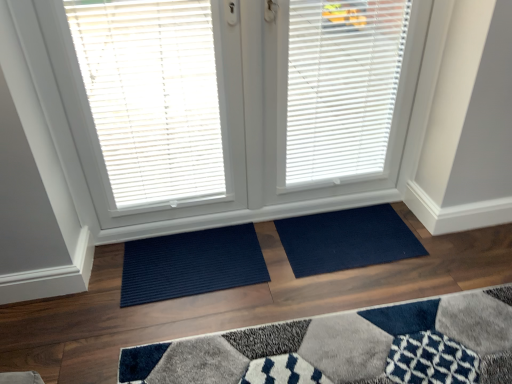
This screenshot has height=384, width=512. What do you see at coordinates (338, 89) in the screenshot? I see `white matte window blind at center, the 1th window blind from the right` at bounding box center [338, 89].

This screenshot has height=384, width=512. I want to click on white matte window blind at center, which ranks as the second window blind in left-to-right order, so click(x=338, y=89).

The image size is (512, 384). What are the coordinates of `navy blue textured mat at lower center, marked as the 2th doormat in a right-to-left arrangement` in the screenshot? It's located at (191, 264).

Describe the element at coordinates (249, 102) in the screenshot. I see `white matte blinds at center` at that location.

At what (x,y) coordinates should I click in order to perform the action: click on white matte blinds at center. Please return your answer as a coordinate pair (x, y). This screenshot has height=384, width=512. Looking at the image, I should click on (249, 102).

What do you see at coordinates (152, 96) in the screenshot? I see `white plastic blinds at upper left, which appears as the first window blind when viewed from the left` at bounding box center [152, 96].

Describe the element at coordinates (346, 240) in the screenshot. I see `navy blue mat at center, the 1th doormat when ordered from right to left` at that location.

Locate an element on the screen. The width and height of the screenshot is (512, 384). white matte window blind at center, which ranks as the second window blind in left-to-right order is located at coordinates pos(338,89).

Considering the sizes of navy blue textured mat at lower center, marked as the 2th doormat in a right-to-left arrangement, and white matte window blind at center, the 1th window blind from the right, in the image, is navy blue textured mat at lower center, marked as the 2th doormat in a right-to-left arrangement, taller or shorter than white matte window blind at center, the 1th window blind from the right,?

navy blue textured mat at lower center, marked as the 2th doormat in a right-to-left arrangement, is shorter than white matte window blind at center, the 1th window blind from the right.

Is navy blue textured mat at lower center, marked as the 2th doormat in a right-to-left arrangement, inside the boundaries of white matte window blind at center, the 1th window blind from the right, or outside?

navy blue textured mat at lower center, marked as the 2th doormat in a right-to-left arrangement, is spatially situated outside white matte window blind at center, the 1th window blind from the right.

Is the surface of navy blue textured mat at lower center, which is counted as the first doormat, starting from the left, in direct contact with white matte window blind at center, which ranks as the second window blind in left-to-right order?

No, navy blue textured mat at lower center, which is counted as the first doormat, starting from the left, is not beside white matte window blind at center, which ranks as the second window blind in left-to-right order.

Which of these two, navy blue textured mat at lower center, marked as the 2th doormat in a right-to-left arrangement, or white matte window blind at center, the 1th window blind from the right, is wider?

navy blue textured mat at lower center, marked as the 2th doormat in a right-to-left arrangement.

Considering the relative positions of white plastic blinds at upper left, which appears as the first window blind when viewed from the left, and white matte window blind at center, the 1th window blind from the right, in the image provided, is white plastic blinds at upper left, which appears as the first window blind when viewed from the left, in front of white matte window blind at center, the 1th window blind from the right,?

Yes.

Considering the positions of points (198, 139) and (312, 114), is point (198, 139) closer to camera compared to point (312, 114)?

Yes.

From the image's perspective, is white plastic blinds at upper left, which ranks as the second window blind in right-to-left order, located beneath white matte window blind at center, the 1th window blind from the right?

Yes.

Which object is wider, navy blue textured mat at lower center, marked as the 2th doormat in a right-to-left arrangement, or white matte blinds at center?

Wider between the two is navy blue textured mat at lower center, marked as the 2th doormat in a right-to-left arrangement.

Is the surface of navy blue textured mat at lower center, marked as the 2th doormat in a right-to-left arrangement, in direct contact with white matte blinds at center?

No, navy blue textured mat at lower center, marked as the 2th doormat in a right-to-left arrangement, is not beside white matte blinds at center.

Consider the image. Is white matte blinds at center inside navy blue textured mat at lower center, marked as the 2th doormat in a right-to-left arrangement?

Definitely not — white matte blinds at center is not inside navy blue textured mat at lower center, marked as the 2th doormat in a right-to-left arrangement.

Locate an element on the screen. Image resolution: width=512 pixels, height=384 pixels. doormat that is the 2nd one below the white matte blinds at center (from a real-world perspective) is located at coordinates (191, 264).

Is navy blue textured mat at lower center, marked as the 2th doormat in a right-to-left arrangement, situated inside white plastic blinds at upper left, which appears as the first window blind when viewed from the left, or outside?

navy blue textured mat at lower center, marked as the 2th doormat in a right-to-left arrangement, exists outside the volume of white plastic blinds at upper left, which appears as the first window blind when viewed from the left.

There is a white plastic blinds at upper left, which appears as the first window blind when viewed from the left. In order to click on the 2nd doormat below it (from the image's perspective) in this screenshot , I will do `click(191, 264)`.

Between navy blue textured mat at lower center, which is counted as the first doormat, starting from the left, and white plastic blinds at upper left, which appears as the first window blind when viewed from the left, which one appears on the left side from the viewer's perspective?

From the viewer's perspective, white plastic blinds at upper left, which appears as the first window blind when viewed from the left, appears more on the left side.

Based on the photo, which object is thinner, navy blue textured mat at lower center, which is counted as the first doormat, starting from the left, or white plastic blinds at upper left, which ranks as the second window blind in right-to-left order?

white plastic blinds at upper left, which ranks as the second window blind in right-to-left order.

Looking at this image, in the image, is white matte blinds at center positioned in front of or behind white plastic blinds at upper left, which appears as the first window blind when viewed from the left?

Visually, white matte blinds at center is located behind white plastic blinds at upper left, which appears as the first window blind when viewed from the left.

Where is `bay window above the white plastic blinds at upper left, which ranks as the second window blind in right-to-left order (from the image's perspective)`? The image size is (512, 384). bay window above the white plastic blinds at upper left, which ranks as the second window blind in right-to-left order (from the image's perspective) is located at coordinates (249, 102).

From the image's perspective, which is above, white matte blinds at center or white plastic blinds at upper left, which ranks as the second window blind in right-to-left order?

white matte blinds at center is shown above in the image.

Which object is wider, white plastic blinds at upper left, which appears as the first window blind when viewed from the left, or white matte blinds at center?

white matte blinds at center is wider.

Which is behind, white plastic blinds at upper left, which appears as the first window blind when viewed from the left, or white matte blinds at center?

white matte blinds at center is more distant.

From a real-world perspective, is white plastic blinds at upper left, which ranks as the second window blind in right-to-left order, over white matte blinds at center?

Yes, from a real-world perspective, white plastic blinds at upper left, which ranks as the second window blind in right-to-left order, is over white matte blinds at center

Is white plastic blinds at upper left, which ranks as the second window blind in right-to-left order, oriented away from white matte blinds at center?

Yes, white plastic blinds at upper left, which ranks as the second window blind in right-to-left order, is facing away from white matte blinds at center.

Does point (167, 46) come closer to viewer compared to point (122, 296)?

Yes, it is.

Measure the distance from white plastic blinds at upper left, which appears as the first window blind when viewed from the left, to navy blue textured mat at lower center, marked as the 2th doormat in a right-to-left arrangement.

18.95 inches.

Considering the relative sizes of white plastic blinds at upper left, which appears as the first window blind when viewed from the left, and navy blue textured mat at lower center, which is counted as the first doormat, starting from the left, in the image provided, is white plastic blinds at upper left, which appears as the first window blind when viewed from the left, taller than navy blue textured mat at lower center, which is counted as the first doormat, starting from the left,?

Yes.

Which is correct: white plastic blinds at upper left, which ranks as the second window blind in right-to-left order, is inside navy blue textured mat at lower center, which is counted as the first doormat, starting from the left, or outside of it?

The correct answer is: outside.

The width and height of the screenshot is (512, 384). In order to click on the 1st window blind in front of the navy blue textured mat at lower center, marked as the 2th doormat in a right-to-left arrangement in this screenshot , I will do `click(338, 89)`.

Where is `window blind above the white plastic blinds at upper left, which appears as the first window blind when viewed from the left (from the image's perspective)`? window blind above the white plastic blinds at upper left, which appears as the first window blind when viewed from the left (from the image's perspective) is located at coordinates (338, 89).

Which object lies further to the anchor point navy blue textured mat at lower center, which is counted as the first doormat, starting from the left, navy blue mat at center, the 1th doormat when ordered from right to left, or white matte blinds at center?

The object further to navy blue textured mat at lower center, which is counted as the first doormat, starting from the left, is white matte blinds at center.

From the picture: Estimate the real-world distances between objects in this image. Which object is further from navy blue mat at center, the 1th doormat when ordered from right to left, white matte blinds at center or navy blue textured mat at lower center, marked as the 2th doormat in a right-to-left arrangement?

white matte blinds at center lies further to navy blue mat at center, the 1th doormat when ordered from right to left, than the other object.

From the image, which object appears to be nearer to white plastic blinds at upper left, which appears as the first window blind when viewed from the left, white matte window blind at center, which ranks as the second window blind in left-to-right order, or navy blue mat at center, the 1th doormat when ordered from right to left?

Based on the image, white matte window blind at center, which ranks as the second window blind in left-to-right order, appears to be nearer to white plastic blinds at upper left, which appears as the first window blind when viewed from the left.

Looking at the image, which one is located closer to navy blue textured mat at lower center, marked as the 2th doormat in a right-to-left arrangement, navy blue mat at center, which appears as the second doormat when viewed from the left, or white plastic blinds at upper left, which appears as the first window blind when viewed from the left?

navy blue mat at center, which appears as the second doormat when viewed from the left, is closer to navy blue textured mat at lower center, marked as the 2th doormat in a right-to-left arrangement.

Estimate the real-world distances between objects in this image. Which object is further from navy blue mat at center, the 1th doormat when ordered from right to left, navy blue textured mat at lower center, marked as the 2th doormat in a right-to-left arrangement, or white matte window blind at center, the 1th window blind from the right?

white matte window blind at center, the 1th window blind from the right.

In the scene shown: Estimate the real-world distances between objects in this image. Which object is closer to white plastic blinds at upper left, which ranks as the second window blind in right-to-left order, navy blue textured mat at lower center, marked as the 2th doormat in a right-to-left arrangement, or white matte window blind at center, the 1th window blind from the right?

white matte window blind at center, the 1th window blind from the right, is positioned closer to the anchor white plastic blinds at upper left, which ranks as the second window blind in right-to-left order.

Which object lies further to the anchor point white matte blinds at center, navy blue mat at center, which appears as the second doormat when viewed from the left, or white plastic blinds at upper left, which ranks as the second window blind in right-to-left order?

navy blue mat at center, which appears as the second doormat when viewed from the left, lies further to white matte blinds at center than the other object.

Considering their positions, is white matte window blind at center, which ranks as the second window blind in left-to-right order, positioned further to navy blue mat at center, which appears as the second doormat when viewed from the left, than navy blue textured mat at lower center, which is counted as the first doormat, starting from the left?

The object further to navy blue mat at center, which appears as the second doormat when viewed from the left, is white matte window blind at center, which ranks as the second window blind in left-to-right order.

Where is `bay window between white matte window blind at center, which ranks as the second window blind in left-to-right order, and navy blue textured mat at lower center, marked as the 2th doormat in a right-to-left arrangement, from top to bottom`? This screenshot has width=512, height=384. bay window between white matte window blind at center, which ranks as the second window blind in left-to-right order, and navy blue textured mat at lower center, marked as the 2th doormat in a right-to-left arrangement, from top to bottom is located at coordinates (249, 102).

The image size is (512, 384). Find the location of `doormat between white plastic blinds at upper left, which appears as the first window blind when viewed from the left, and white matte window blind at center, the 1th window blind from the right`. doormat between white plastic blinds at upper left, which appears as the first window blind when viewed from the left, and white matte window blind at center, the 1th window blind from the right is located at coordinates pos(191,264).

At what (x,y) coordinates should I click in order to perform the action: click on bay window between navy blue textured mat at lower center, marked as the 2th doormat in a right-to-left arrangement, and navy blue mat at center, the 1th doormat when ordered from right to left, in the horizontal direction. Please return your answer as a coordinate pair (x, y). This screenshot has width=512, height=384. Looking at the image, I should click on (249, 102).

Locate an element on the screen. The width and height of the screenshot is (512, 384). bay window between white plastic blinds at upper left, which appears as the first window blind when viewed from the left, and white matte window blind at center, the 1th window blind from the right, from left to right is located at coordinates click(249, 102).